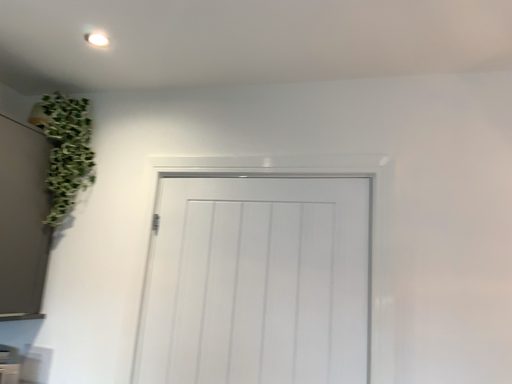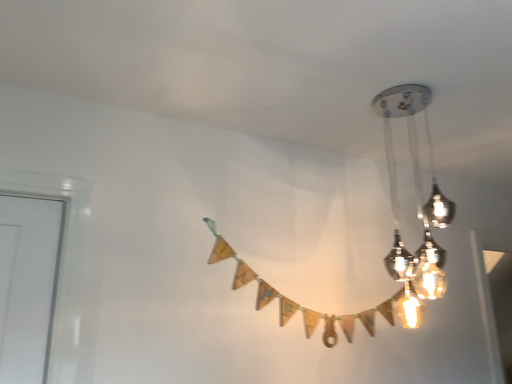
Question: How did the camera likely rotate when shooting the video?

Choices:
 (A) rotated right
 (B) rotated left

Answer: (A)